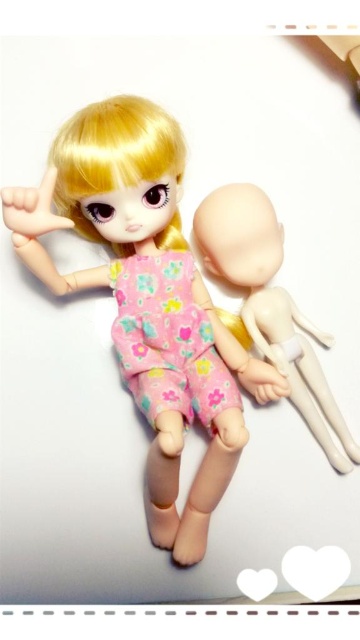
Question: Is the position of matte pink fabric doll at center more distant than that of smooth beige head at center?

Choices:
 (A) yes
 (B) no

Answer: (B)

Question: Which of the following is the farthest from the observer?

Choices:
 (A) matte pink fabric doll at center
 (B) smooth beige head at center

Answer: (B)

Question: Which point is farther to the camera?

Choices:
 (A) smooth beige head at center
 (B) matte pink fabric doll at center

Answer: (A)

Question: Can you confirm if matte pink fabric doll at center is bigger than smooth beige head at center?

Choices:
 (A) no
 (B) yes

Answer: (B)

Question: From the image, what is the correct spatial relationship of matte pink fabric doll at center in relation to smooth beige head at center?

Choices:
 (A) left
 (B) right

Answer: (A)